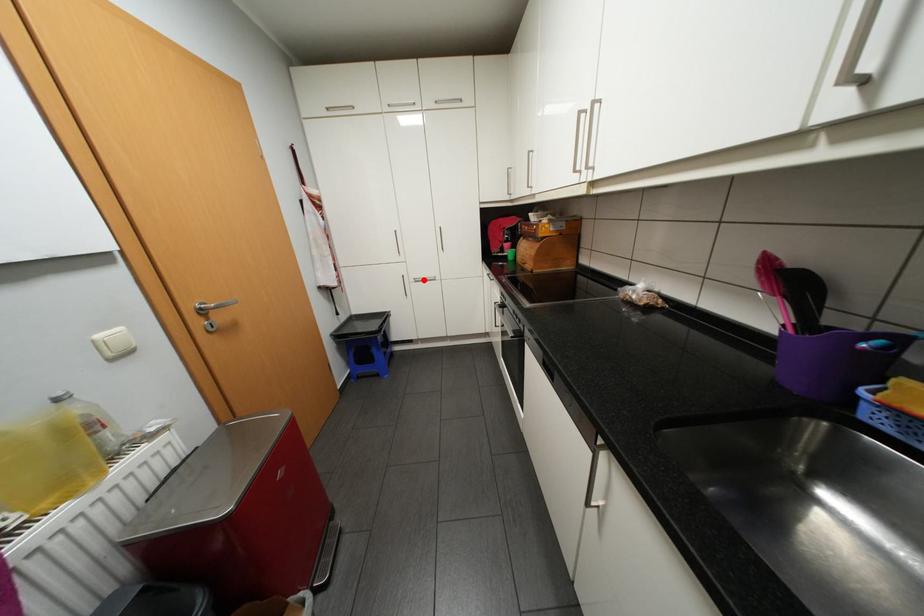
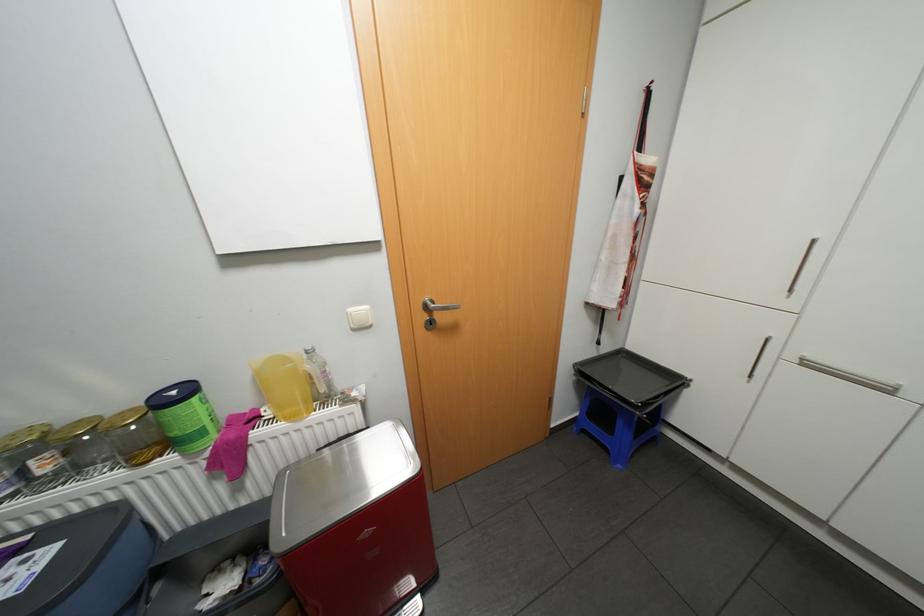
In the second image, find the point that corresponds to the highlighted location in the first image.

(813, 363)